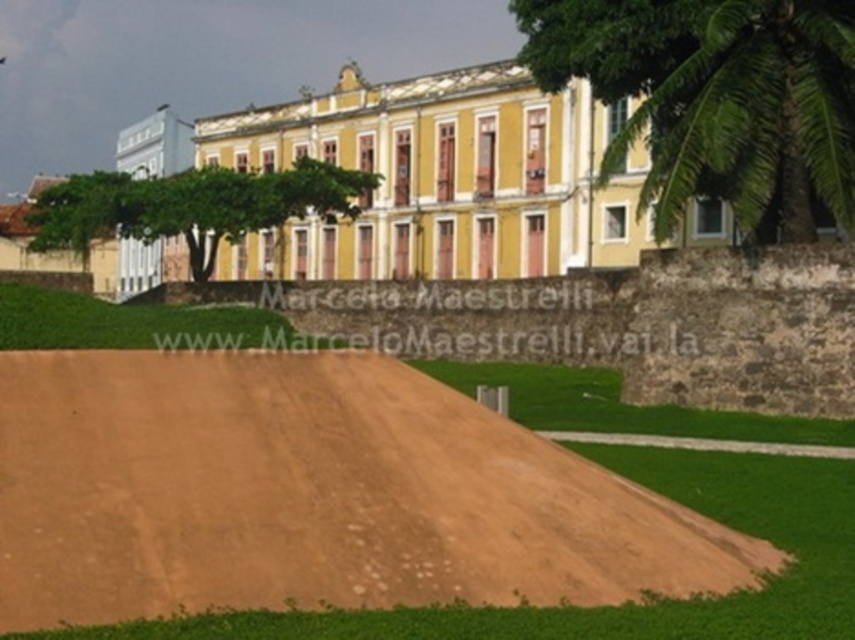
Find the location of a particular element. The width and height of the screenshot is (855, 640). brown sandy dirt at center is located at coordinates (311, 493).